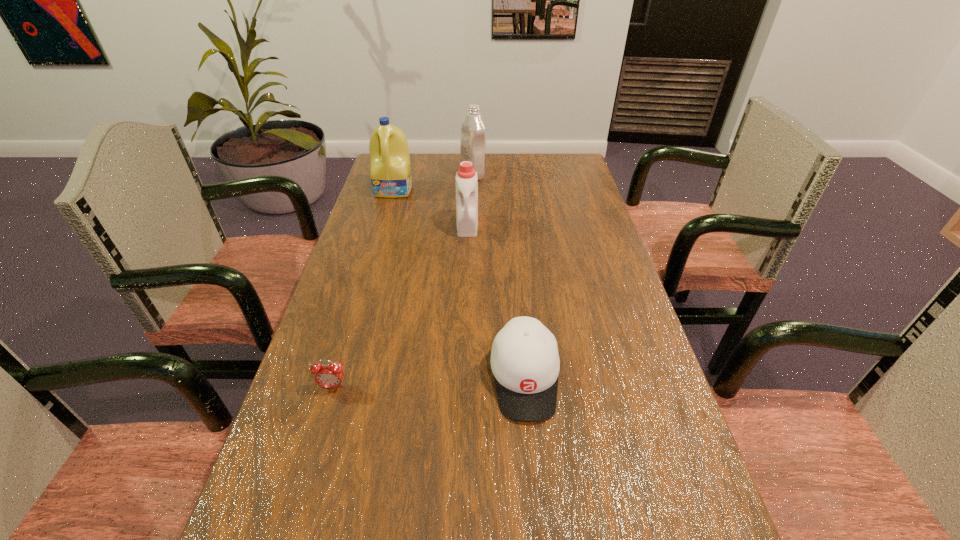
Where is `the leftmost detergent`? the leftmost detergent is located at coordinates (391, 177).

I want to click on the third nearest object, so click(466, 183).

The width and height of the screenshot is (960, 540). I want to click on the third shortest object, so point(466,183).

Identify the location of the rightmost object. (525, 362).

Locate an element on the screen. the second shortest object is located at coordinates (525, 362).

The width and height of the screenshot is (960, 540). Find the location of `the shortest object`. the shortest object is located at coordinates (327, 375).

Image resolution: width=960 pixels, height=540 pixels. What are the coordinates of `vacant space situated on the label of the leftmost detergent` in the screenshot? It's located at (384, 226).

The image size is (960, 540). I want to click on vacant space located on the handle side of the third tallest object, so click(465, 291).

Where is `vacant region located 0.100m on the front-facing side of the baseball cap`? vacant region located 0.100m on the front-facing side of the baseball cap is located at coordinates (534, 476).

Locate an element on the screen. The height and width of the screenshot is (540, 960). blank space located on the face of the alarm clock is located at coordinates (317, 442).